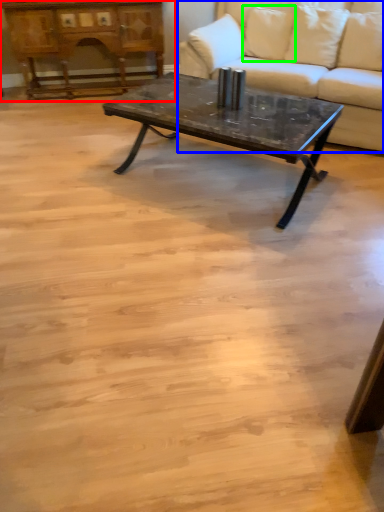
Question: Considering the real-world distances, which object is closest to dresser (highlighted by a red box)? studio couch (highlighted by a blue box) or pillow (highlighted by a green box).

Choices:
 (A) studio couch
 (B) pillow

Answer: (A)